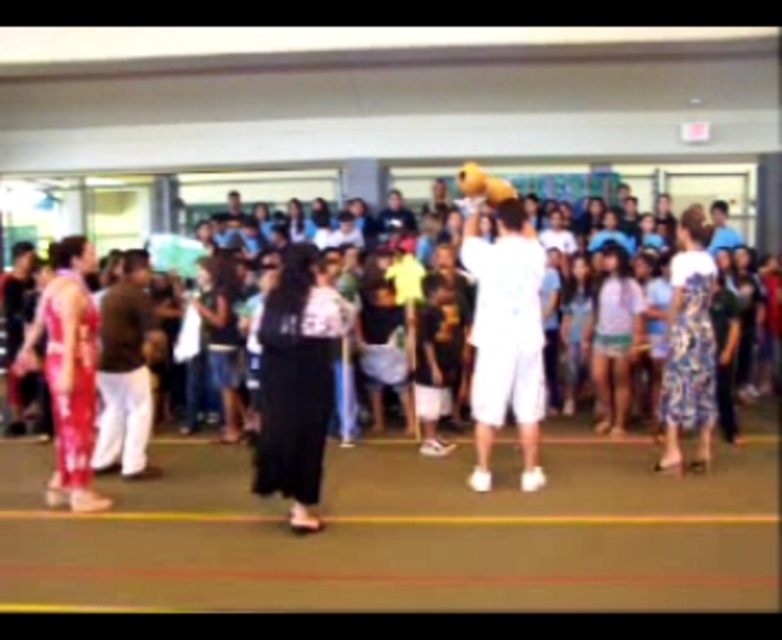
Question: Based on their relative distances, which object is nearer to the white cotton shorts at center?

Choices:
 (A) black fabric dress at center
 (B) shiny red fabric pants at left

Answer: (A)

Question: Is black fabric dress at center bigger than white cotton shorts at center?

Choices:
 (A) yes
 (B) no

Answer: (A)

Question: Which object appears closest to the camera in this image?

Choices:
 (A) shiny red fabric pants at left
 (B) white cotton shorts at center

Answer: (A)

Question: Which of the following is the closest to the observer?

Choices:
 (A) (277, 344)
 (B) (515, 372)

Answer: (A)

Question: Is white cotton shorts at center bigger than shiny red fabric pants at left?

Choices:
 (A) no
 (B) yes

Answer: (A)

Question: Observing the image, what is the correct spatial positioning of black fabric dress at center in reference to shiny red fabric pants at left?

Choices:
 (A) below
 (B) above

Answer: (A)